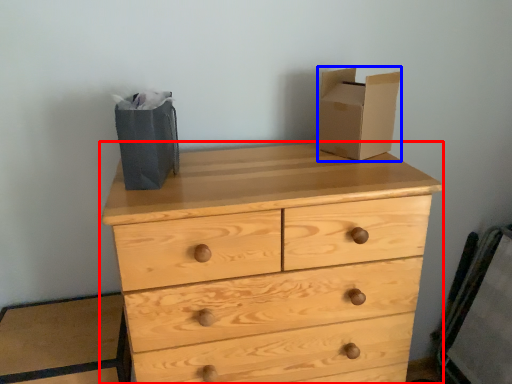
Question: Which object is further to the camera taking this photo, chest of drawers (highlighted by a red box) or cardboard box (highlighted by a blue box)?

Choices:
 (A) chest of drawers
 (B) cardboard box

Answer: (B)